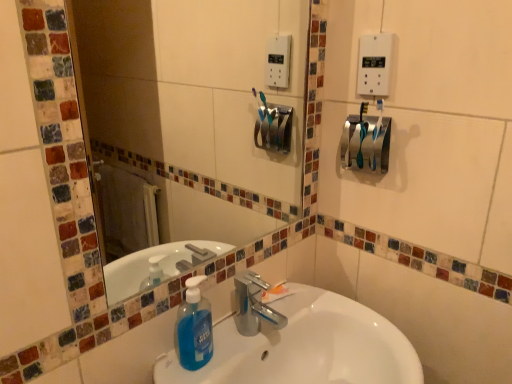
Question: Is blue translucent liquid soap at center taller or shorter than glass mosaic mirror at upper center?

Choices:
 (A) short
 (B) tall

Answer: (A)

Question: Considering the positions of blue translucent liquid soap at center and glass mosaic mirror at upper center in the image, is blue translucent liquid soap at center bigger or smaller than glass mosaic mirror at upper center?

Choices:
 (A) big
 (B) small

Answer: (B)

Question: Based on their relative distances, which object is farther from the glass mosaic mirror at upper center?

Choices:
 (A) white plastic light switch at upper right
 (B) satin silver towel bar at upper right
 (C) white glossy sink at center
 (D) blue translucent liquid soap at center

Answer: (D)

Question: Which is nearer to the glass mosaic mirror at upper center?

Choices:
 (A) white plastic light switch at upper right
 (B) satin silver towel bar at upper right
 (C) blue translucent liquid soap at center
 (D) white glossy sink at center

Answer: (D)